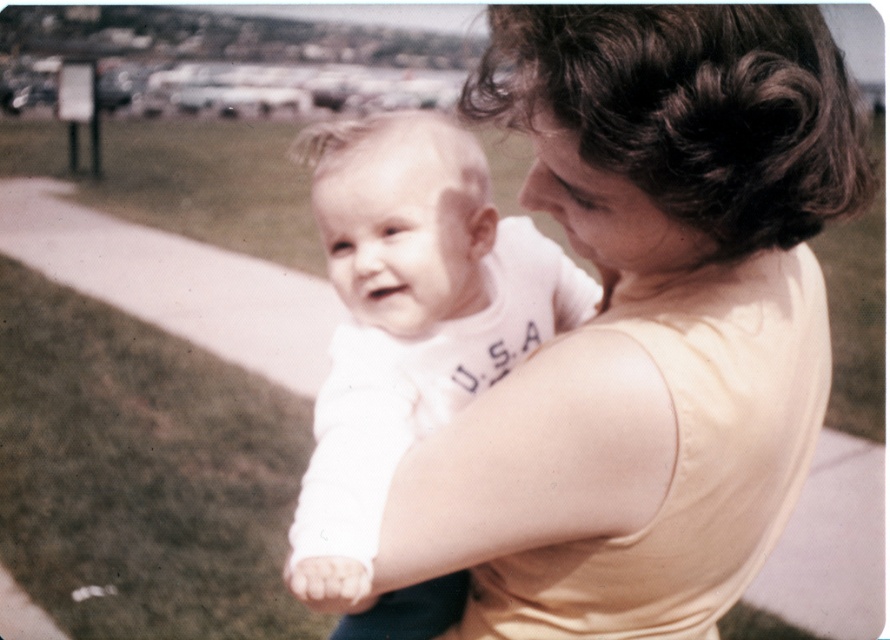
Is matte yellow tank top at center to the left of white cotton shirt at center from the viewer's perspective?

In fact, matte yellow tank top at center is to the right of white cotton shirt at center.

Who is more distant from viewer, [735,550] or [441,227]?

The point [441,227] is more distant.

At what (x,y) coordinates should I click in order to perform the action: click on matte yellow tank top at center. Please return your answer as a coordinate pair (x, y). This screenshot has width=890, height=640. Looking at the image, I should click on (643, 326).